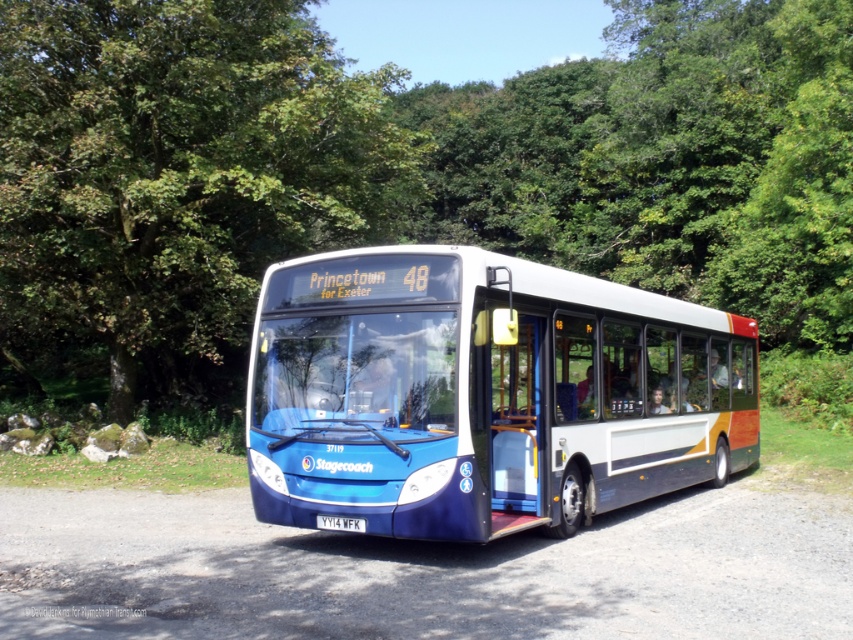
You are a photographer planning to capture a photo of the blue metallic bus at center while ensuring the green leafy tree at center is fully visible in the background. Based on their heights, will the tree obscure the view of the bus?

The green leafy tree at center is taller than the blue metallic bus at center, so the tree may block part of the bus if positioned directly behind it. To ensure the entire bus is visible, position yourself so the tree is not directly behind the bus or adjust the angle to avoid obstruction.

You are standing in front of the Stagecoach bus parked on the gravel road. You want to take a photo of the green leafy tree at center while ensuring the bus is also visible in the frame. How far back should you move from the tree to include both the bus and the tree in your photo?

To include both the green leafy tree at center and the bus in your photo, you should move back approximately 12.81 meters from the tree, as this is the distance between the tree and the camera position where the bus is visible.